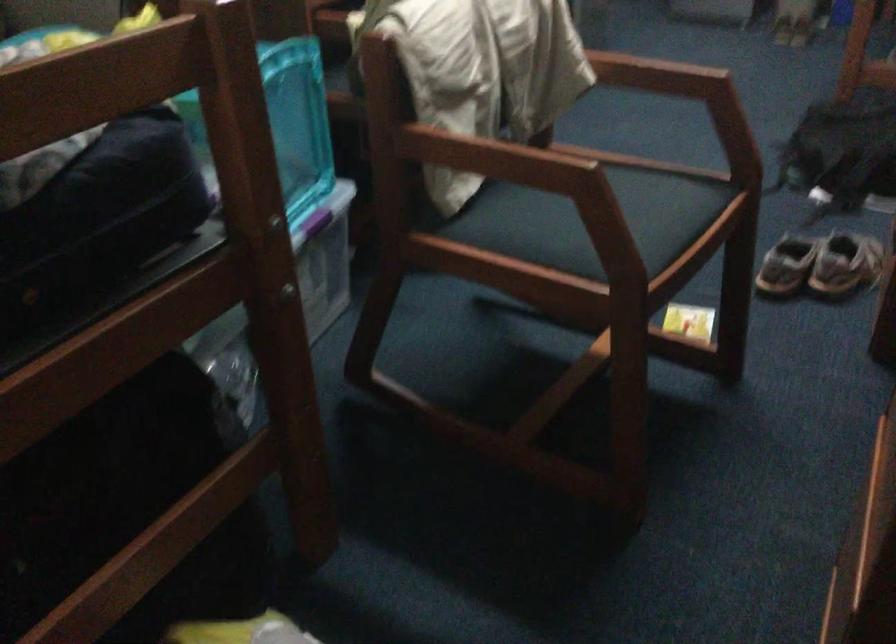
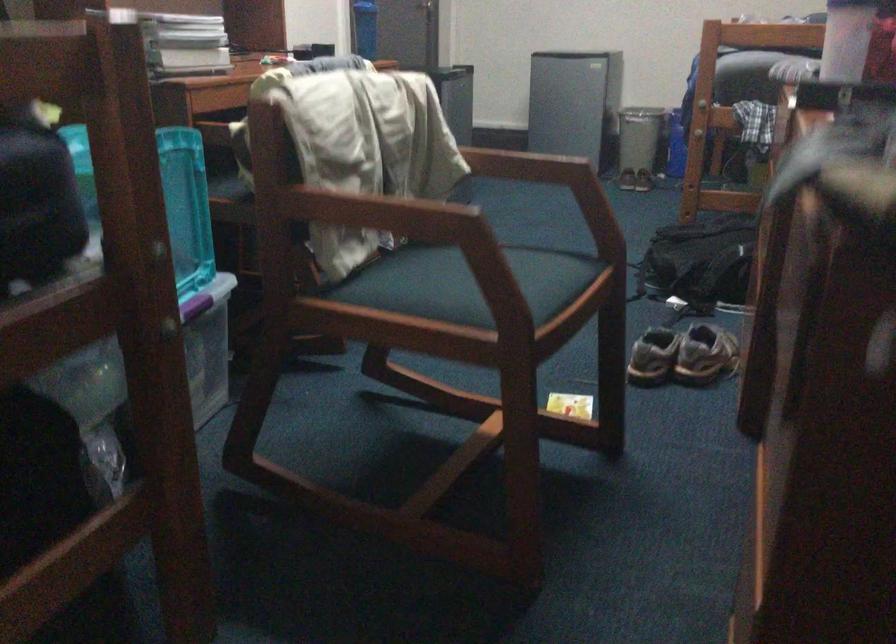
Where in the second image is the point corresponding to (550,160) from the first image?

(436, 210)